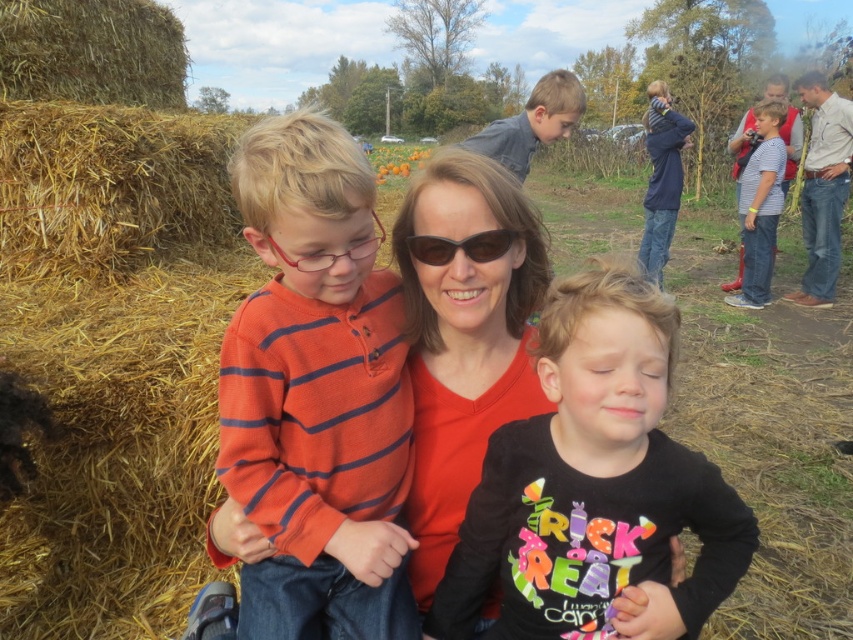
Question: Is orange striped sweater at left below striped cotton shirt at right?

Choices:
 (A) no
 (B) yes

Answer: (B)

Question: Is matte orange sweater at center to the left of denim shirt at upper center from the viewer's perspective?

Choices:
 (A) yes
 (B) no

Answer: (A)

Question: Which of the following is the closest to the observer?

Choices:
 (A) (473, 234)
 (B) (311, 456)

Answer: (A)

Question: Which point is farther from the camera taking this photo?

Choices:
 (A) (167, 99)
 (B) (482, 253)
 (C) (671, 113)

Answer: (C)

Question: Which object appears farthest from the camera in this image?

Choices:
 (A) blue denim jacket at upper center
 (B) orange striped sweater at left
 (C) brown straw bale at left
 (D) sunglasses at center

Answer: (A)

Question: Is black matte shirt at center wider than striped cotton shirt at right?

Choices:
 (A) no
 (B) yes

Answer: (A)